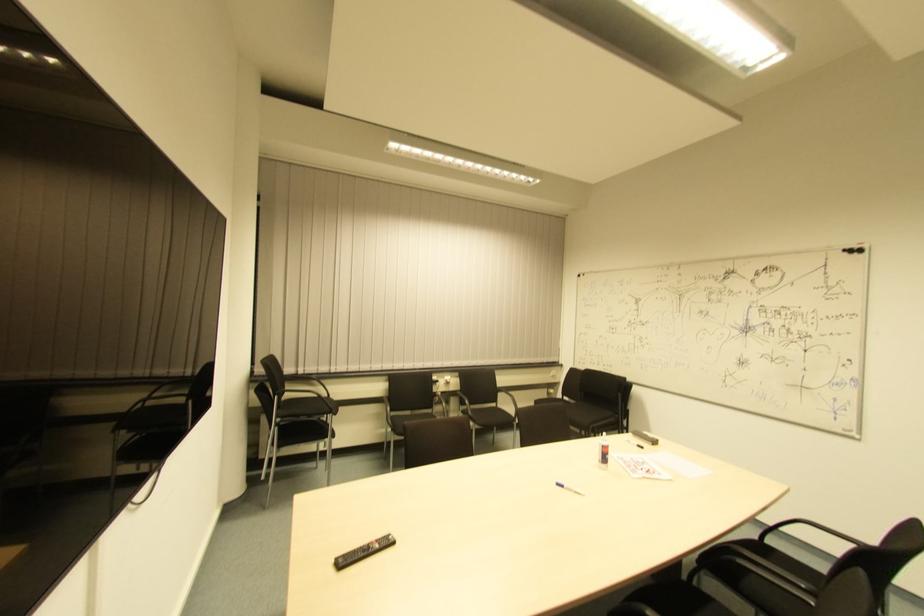
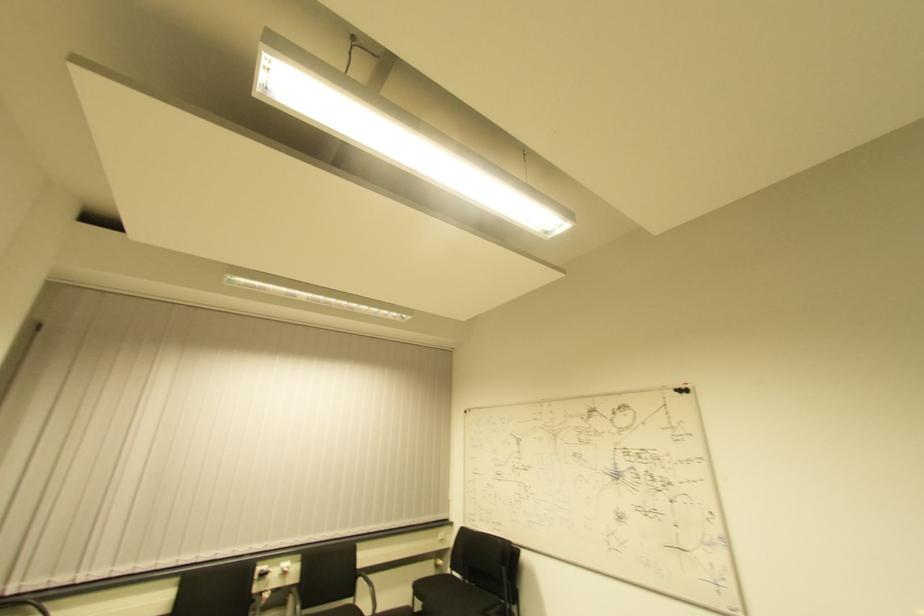
Question: Which direction would the cameraman need to move to produce the second image? Reply with the corresponding letter.

Choices:
 (A) Left
 (B) Right
 (C) Forward
 (D) Backward

Answer: (B)